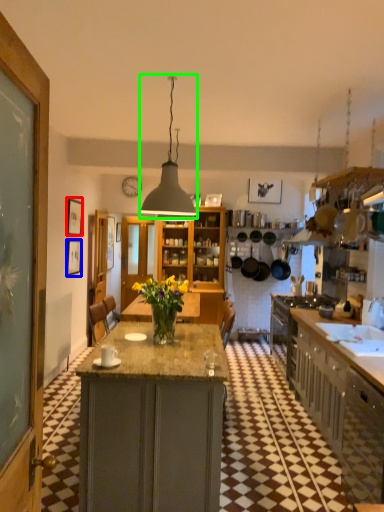
Question: Which object is positioned closest to picture frame (highlighted by a red box)? Select from picture frame (highlighted by a blue box) and light fixture (highlighted by a green box).

Choices:
 (A) picture frame
 (B) light fixture

Answer: (A)